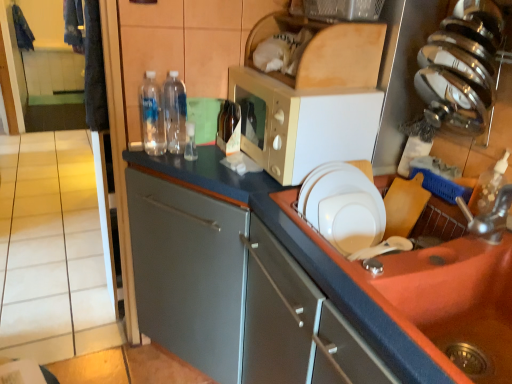
Find the location of a particular element. Image resolution: width=512 pixels, height=384 pixels. free location to the right of clear plastic bottle at center, marked as the 1th bottle in a left-to-right arrangement is located at coordinates (204, 157).